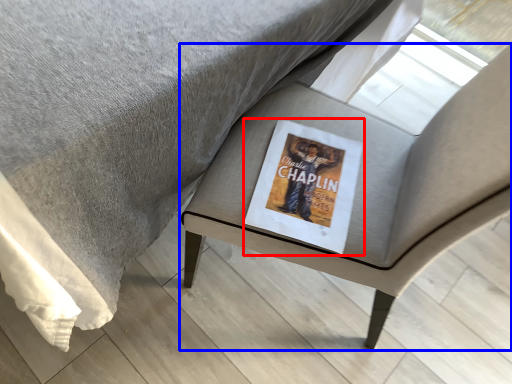
Question: Which point is closer to the camera, paperback book (highlighted by a red box) or chair (highlighted by a blue box)?

Choices:
 (A) paperback book
 (B) chair

Answer: (B)